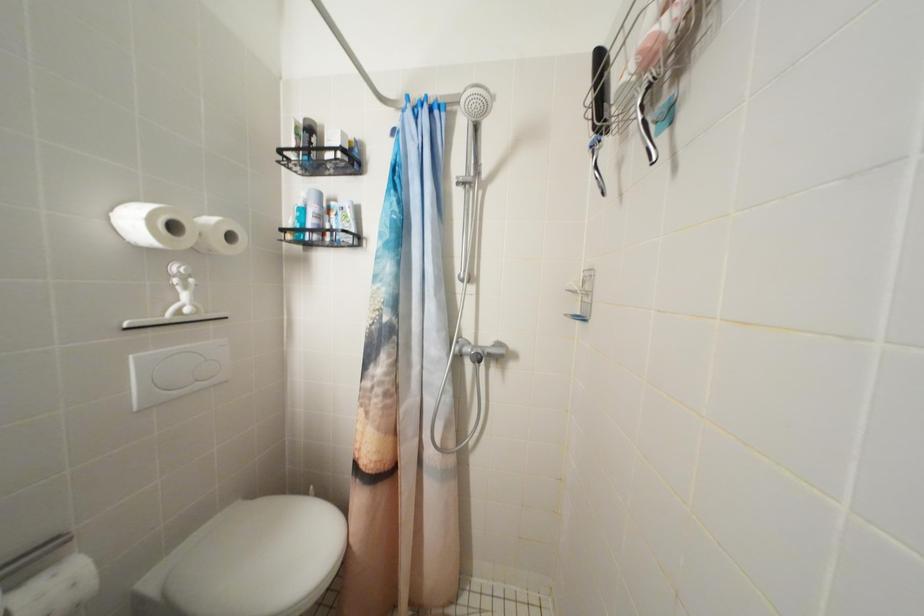
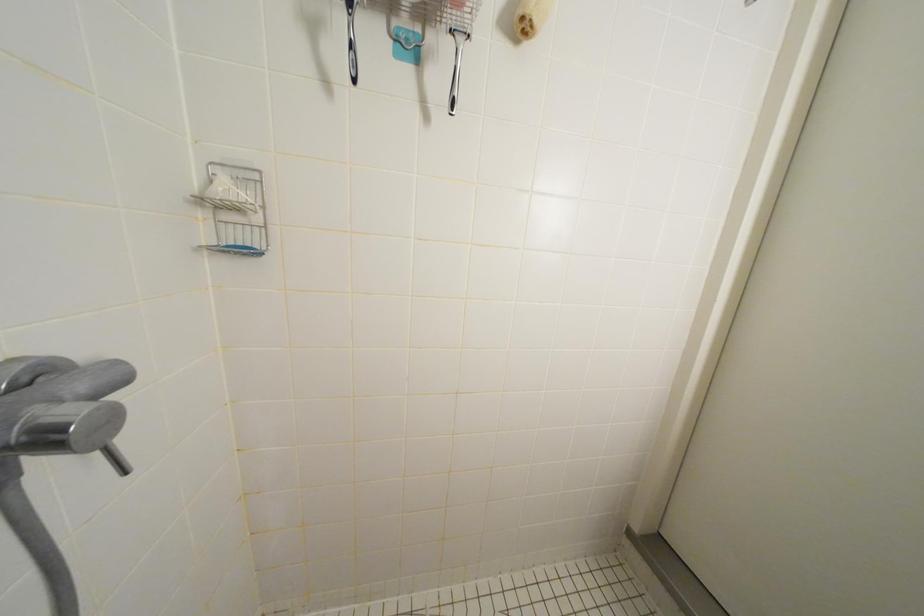
First-person continuous shooting, in which direction is the camera rotating?

The camera's rotation is toward right-down.